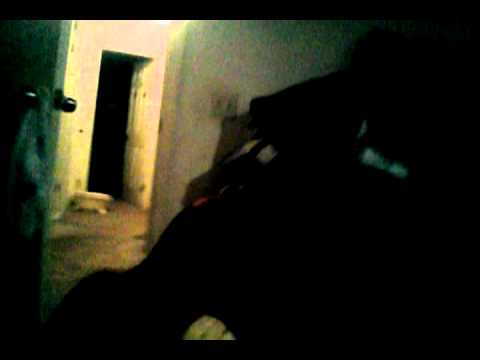
Locate an element on the screen. door knob is located at coordinates (68, 106), (225, 111).